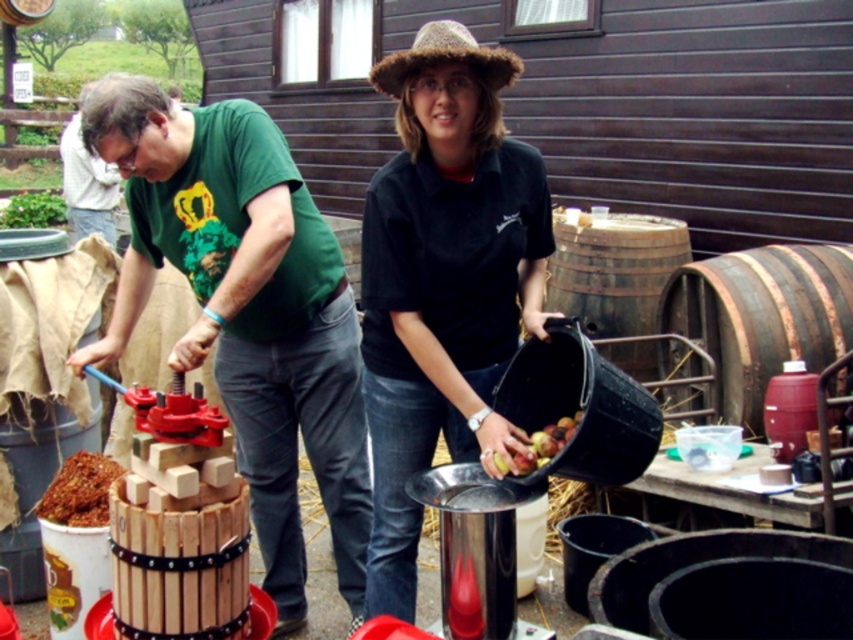
How far apart are brown wooden barrel at right and wooden barrel at right?

brown wooden barrel at right and wooden barrel at right are 23.25 inches apart from each other.

Can you confirm if brown wooden barrel at right is thinner than wooden barrel at right?

Incorrect, brown wooden barrel at right's width is not less than wooden barrel at right's.

Between point (751, 250) and point (608, 268), which one is positioned behind?

Point (608, 268)

Find the location of a particular element. Image resolution: width=853 pixels, height=640 pixels. brown wooden barrel at right is located at coordinates (762, 316).

Does wooden barrel at center have a greater width compared to crumbly brown cake at lower left?

Indeed, wooden barrel at center has a greater width compared to crumbly brown cake at lower left.

Which is behind, point (257, 416) or point (105, 477)?

The point (105, 477) is more distant.

Find the location of a particular element. wooden barrel at center is located at coordinates (253, 324).

Looking at this image, is brown wooden barrel at right closer to camera compared to crumbly brown cake at lower left?

No, brown wooden barrel at right is further to the viewer.

Who is taller, brown wooden barrel at right or crumbly brown cake at lower left?

With more height is brown wooden barrel at right.

Image resolution: width=853 pixels, height=640 pixels. What do you see at coordinates (762, 316) in the screenshot? I see `brown wooden barrel at right` at bounding box center [762, 316].

Locate an element on the screen. The height and width of the screenshot is (640, 853). brown wooden barrel at right is located at coordinates (762, 316).